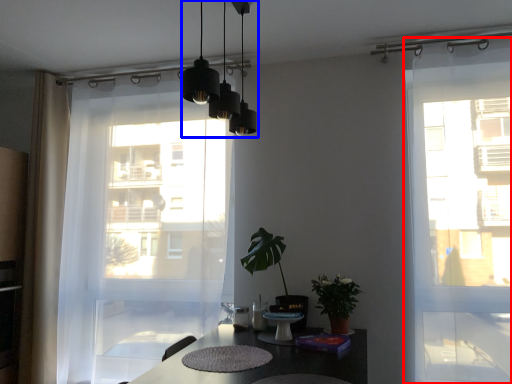
Question: Which object appears closest to the camera in this image, door (highlighted by a red box) or lighting (highlighted by a blue box)?

Choices:
 (A) door
 (B) lighting

Answer: (B)